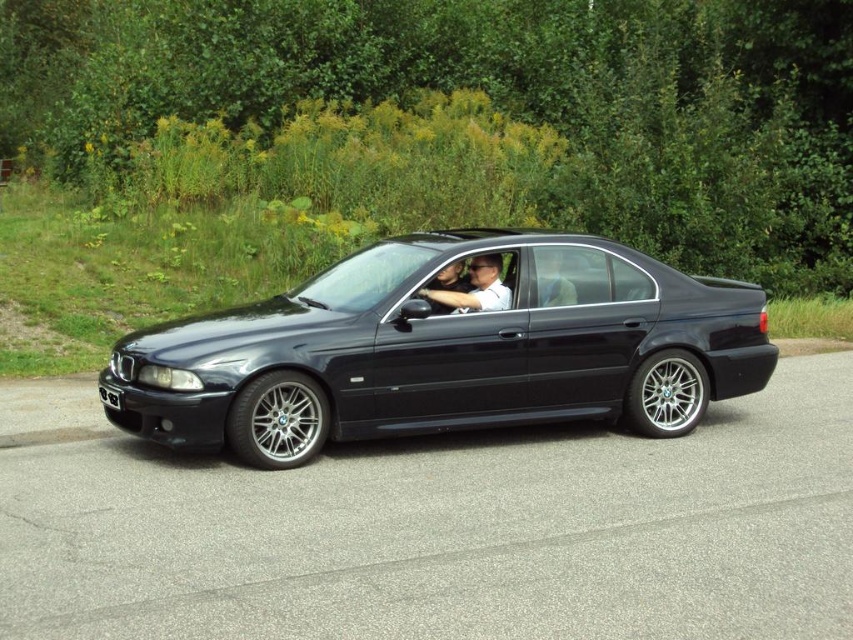
What is the color of the car located at the point marked by coordinates (x=477, y=288)?

The car at point (x=477, y=288) is matte black.